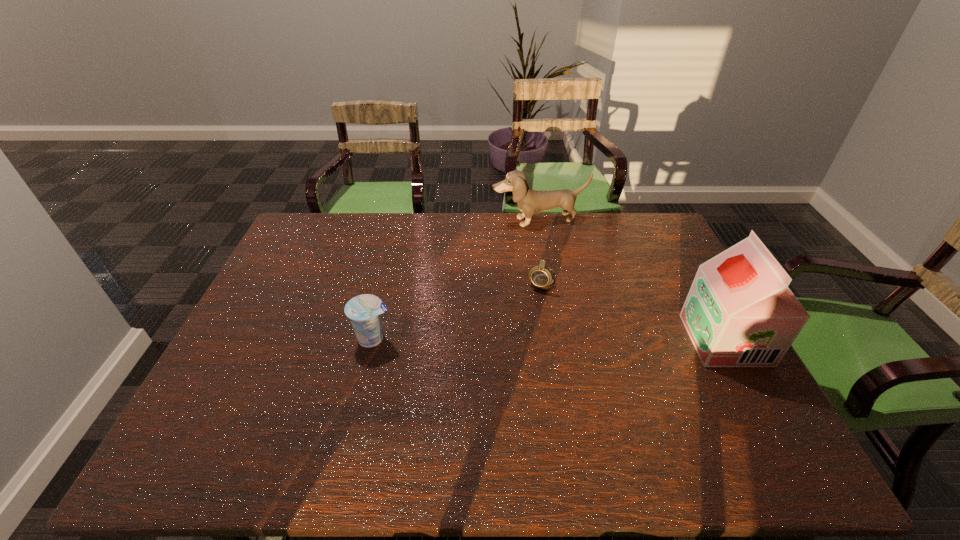
Locate an element on the screen. unoccupied position between the yogurt and the third nearest object is located at coordinates (457, 310).

The height and width of the screenshot is (540, 960). What are the coordinates of `free area in between the soya milk and the farthest object` in the screenshot? It's located at (632, 280).

Locate an element on the screen. free point between the compass and the soya milk is located at coordinates (633, 310).

This screenshot has height=540, width=960. In order to click on vacant space that's between the rightmost object and the farthest object in this screenshot , I will do `click(632, 280)`.

This screenshot has height=540, width=960. Find the location of `object that stands as the closest to the third shortest object`. object that stands as the closest to the third shortest object is located at coordinates (541, 277).

Where is `object that stands as the second closest to the third shortest object`? The image size is (960, 540). object that stands as the second closest to the third shortest object is located at coordinates (739, 312).

The image size is (960, 540). Find the location of `vacant space that satisfies the following two spatial constraints: 1. on the front side of the tallest object; 2. with the cap open on the leftmost object`. vacant space that satisfies the following two spatial constraints: 1. on the front side of the tallest object; 2. with the cap open on the leftmost object is located at coordinates (373, 340).

At what (x,y) coordinates should I click in order to perform the action: click on free space that satisfies the following two spatial constraints: 1. on the front side of the tallest object; 2. with the cap open on the yogurt. Please return your answer as a coordinate pair (x, y). Image resolution: width=960 pixels, height=540 pixels. Looking at the image, I should click on (373, 340).

Identify the location of free space in the image that satisfies the following two spatial constraints: 1. on the front side of the tallest object; 2. with the cap open on the farthest object. (561, 340).

Image resolution: width=960 pixels, height=540 pixels. Identify the location of free spot that satisfies the following two spatial constraints: 1. on the back side of the third nearest object; 2. on the right side of the puppy. (532, 220).